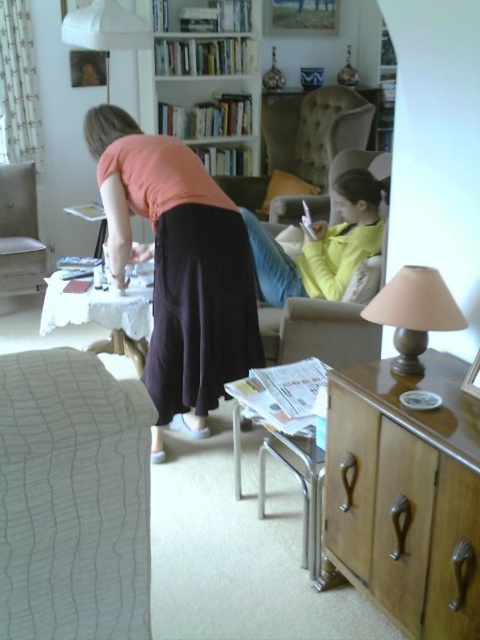
Is light brown leather armchair at center to the right of beige fabric lampshade at right from the viewer's perspective?

In fact, light brown leather armchair at center is to the left of beige fabric lampshade at right.

Does light brown leather armchair at center appear on the left side of beige fabric lampshade at right?

Correct, you'll find light brown leather armchair at center to the left of beige fabric lampshade at right.

Find the location of a particular element. This screenshot has height=640, width=480. light brown leather armchair at center is located at coordinates (303, 140).

Measure the distance between point (10, 532) and camera.

The distance of point (10, 532) from camera is 38.09 inches.

Is white textured fabric at lower left smaller than beige fabric lampshade at right?

Actually, white textured fabric at lower left might be larger than beige fabric lampshade at right.

Which is in front, point (59, 588) or point (425, 292)?

Point (59, 588) is in front.

Locate an element on the screen. white textured fabric at lower left is located at coordinates (72, 499).

Can you confirm if white textured fabric at lower left is smaller than light brown leather armchair at center?

Yes, white textured fabric at lower left is smaller than light brown leather armchair at center.

Is white textured fabric at lower left positioned before light brown leather armchair at center?

Yes, it is in front of light brown leather armchair at center.

Locate an element on the screen. This screenshot has height=640, width=480. white textured fabric at lower left is located at coordinates (72, 499).